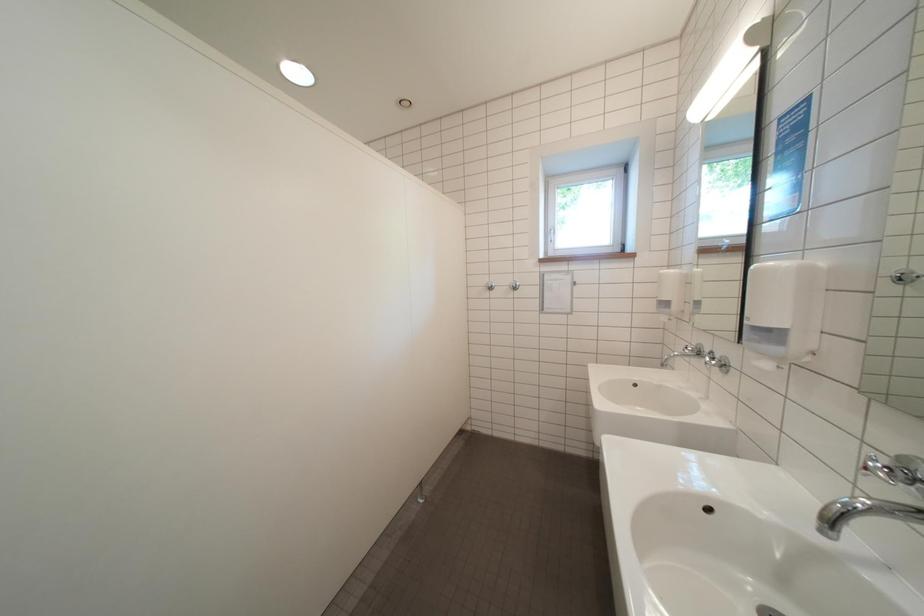
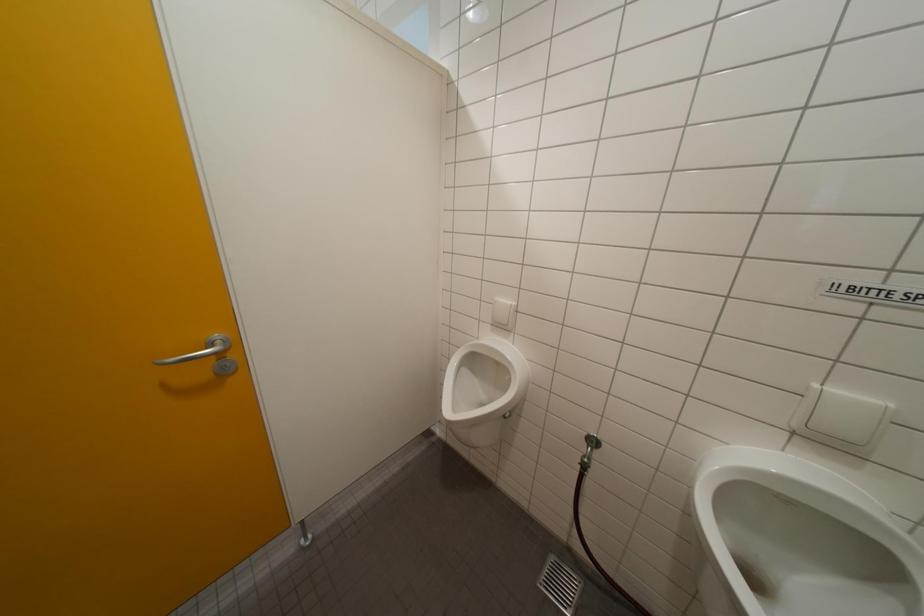
Which direction would the cameraman need to move to produce the second image?

The cameraman moved toward left, forward.